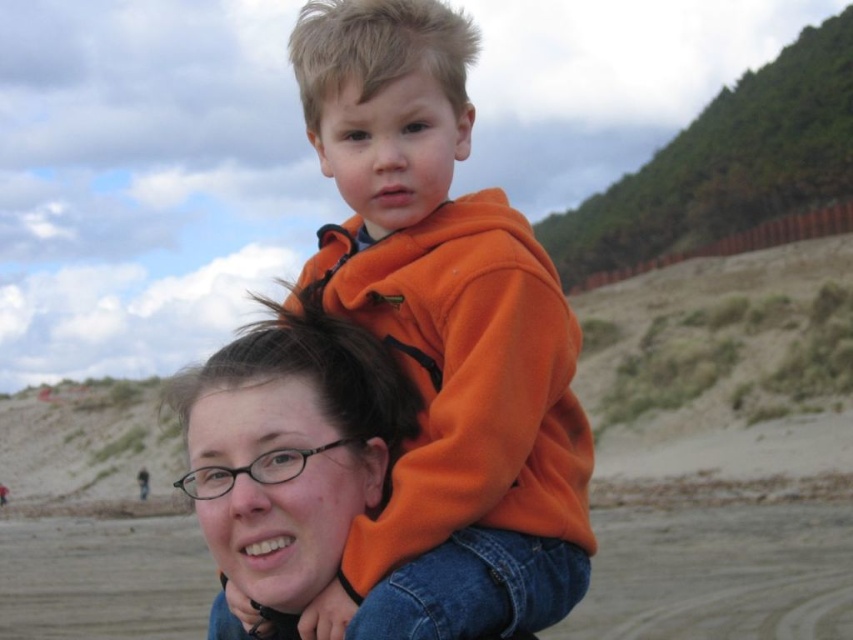
Does orange fleece at center appear on the left side of matte orange hoodie at center?

No, orange fleece at center is not to the left of matte orange hoodie at center.

Which of these two, orange fleece at center or matte orange hoodie at center, stands taller?

With more height is orange fleece at center.

Between point (376, 92) and point (238, 577), which one is positioned in front?

Point (376, 92)

You are a GUI agent. You are given a task and a screenshot of the screen. Output one action in this format:
    pyautogui.click(x=<x>, y=<y>)
    Task: Click on the orange fleece at center
    Image resolution: width=853 pixels, height=640 pixels.
    Given the screenshot: What is the action you would take?
    pyautogui.click(x=442, y=340)